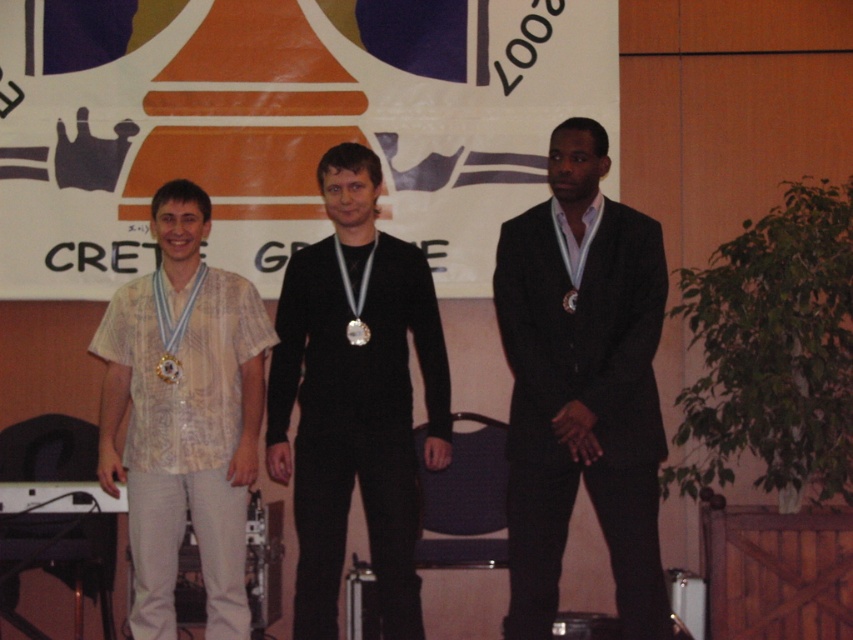
Does dark suit at center come in front of patterned fabric shirt at left?

Yes, dark suit at center is closer to the viewer.

Which is more to the left, dark suit at center or patterned fabric shirt at left?

Positioned to the left is patterned fabric shirt at left.

Does point (598, 388) lie behind point (126, 362)?

No, it is not.

Where is `dark suit at center`? Image resolution: width=853 pixels, height=640 pixels. dark suit at center is located at coordinates (581, 385).

Is dark suit at center to the right of gold shiny medal at center from the viewer's perspective?

Yes, dark suit at center is to the right of gold shiny medal at center.

Is dark suit at center closer to camera compared to gold shiny medal at center?

Yes, it is in front of gold shiny medal at center.

At what (x,y) coordinates should I click in order to perform the action: click on dark suit at center. Please return your answer as a coordinate pair (x, y). The width and height of the screenshot is (853, 640). Looking at the image, I should click on (581, 385).

Who is positioned more to the right, shiny silver medal at center or patterned fabric shirt at left?

shiny silver medal at center is more to the right.

Does shiny silver medal at center appear on the left side of patterned fabric shirt at left?

Incorrect, shiny silver medal at center is not on the left side of patterned fabric shirt at left.

I want to click on shiny silver medal at center, so click(355, 397).